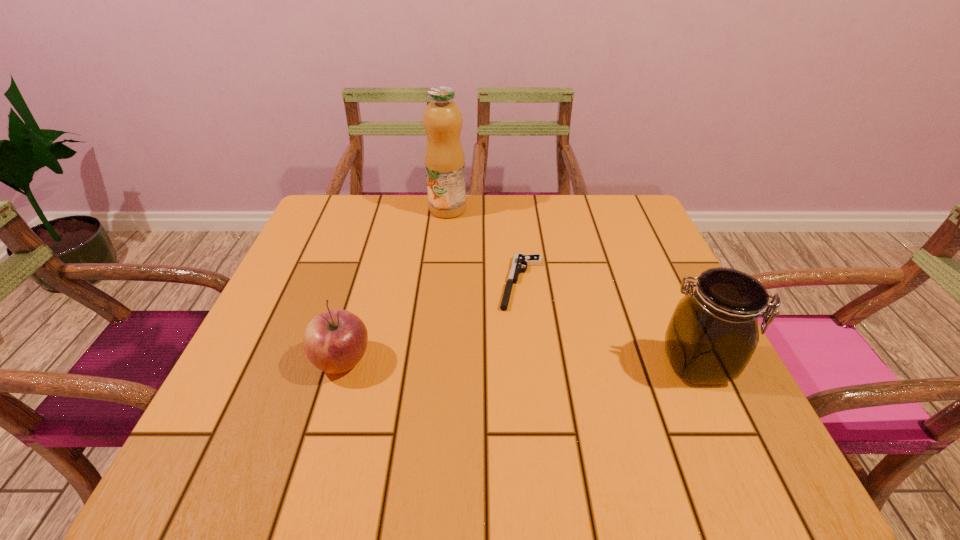
Locate an element on the screen. apple is located at coordinates (334, 341).

This screenshot has height=540, width=960. What are the coordinates of `the second shortest object` in the screenshot? It's located at tap(334, 341).

Where is `jar`? The width and height of the screenshot is (960, 540). jar is located at coordinates [x=713, y=333].

Identify the location of the third shortest object. Image resolution: width=960 pixels, height=540 pixels. (713, 333).

Where is `fruit juice`? fruit juice is located at coordinates (442, 119).

You are a GUI agent. You are given a task and a screenshot of the screen. Output one action in this format:
    pyautogui.click(x=<x>, y=<y>)
    Task: Click on the farthest object
    The image size is (960, 540).
    Given the screenshot: What is the action you would take?
    pyautogui.click(x=442, y=119)

The width and height of the screenshot is (960, 540). I want to click on the third nearest object, so click(x=519, y=260).

Locate an element on the screen. The width and height of the screenshot is (960, 540). the shortest object is located at coordinates (519, 260).

Where is `free location located on the right of the apple`? The height and width of the screenshot is (540, 960). free location located on the right of the apple is located at coordinates (539, 361).

The width and height of the screenshot is (960, 540). Identify the location of free spot located on the front label of the fruit juice. (453, 236).